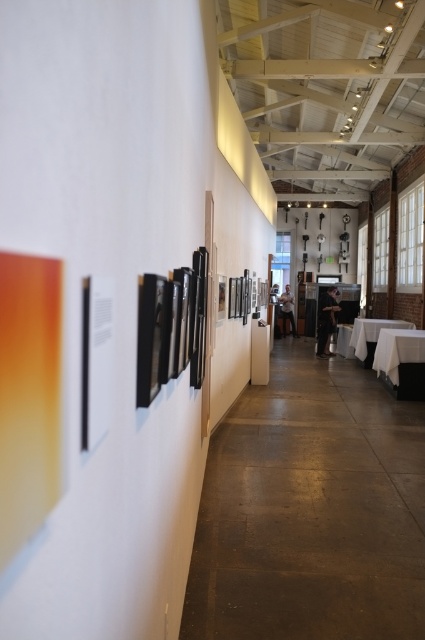
From the picture: Does white cloth-covered table at right have a smaller size compared to white glossy table at center?

No.

Is white cloth-covered table at right thinner than white glossy table at center?

Incorrect, white cloth-covered table at right's width is not less than white glossy table at center's.

Between point (410, 333) and point (346, 349), which one is positioned behind?

The point (346, 349) is behind.

Identify the location of white cloth-covered table at right. (397, 349).

Is white cloth-covered table at right below white cloth table at center?

Yes.

Is white cloth-covered table at right positioned before white cloth table at center?

Yes, white cloth-covered table at right is in front of white cloth table at center.

This screenshot has width=425, height=640. Identify the location of white cloth-covered table at right. (397, 349).

At what (x,y) coordinates should I click in order to perform the action: click on white cloth-covered table at right. Please return your answer as a coordinate pair (x, y). Looking at the image, I should click on (397, 349).

Does white cloth table at center have a greater height compared to white glossy table at center?

Indeed, white cloth table at center has a greater height compared to white glossy table at center.

Which is in front, point (407, 323) or point (350, 352)?

Point (407, 323) is in front.

Where is `white cloth table at center`? white cloth table at center is located at coordinates (371, 332).

This screenshot has height=640, width=425. I want to click on white cloth table at center, so click(x=371, y=332).